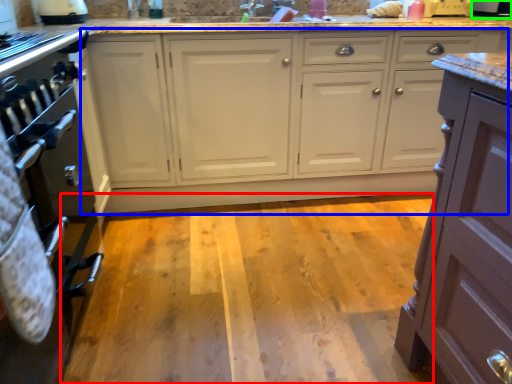
Question: Which is farther away from plain (highlighted by a red box)? cabinetry (highlighted by a blue box) or appliance (highlighted by a green box)?

Choices:
 (A) cabinetry
 (B) appliance

Answer: (B)